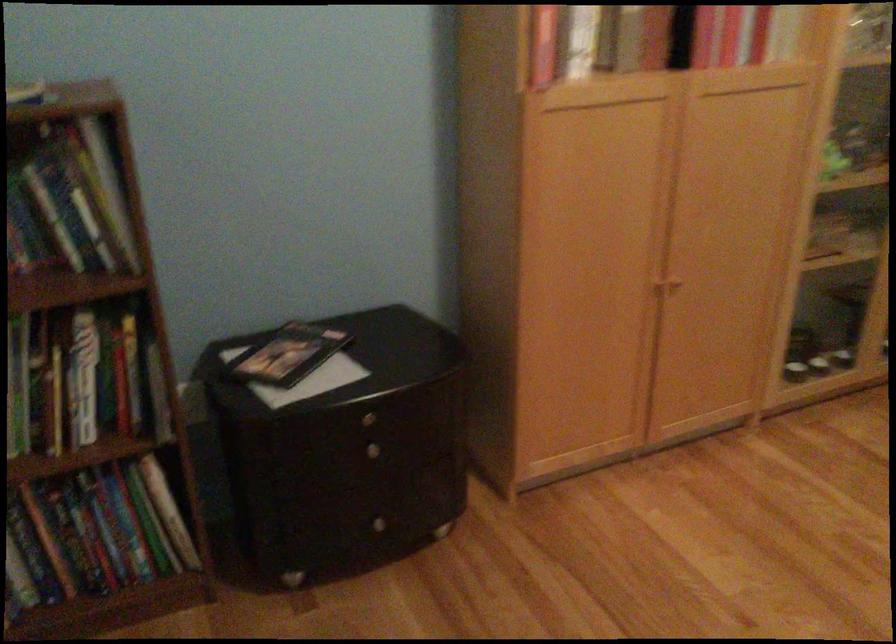
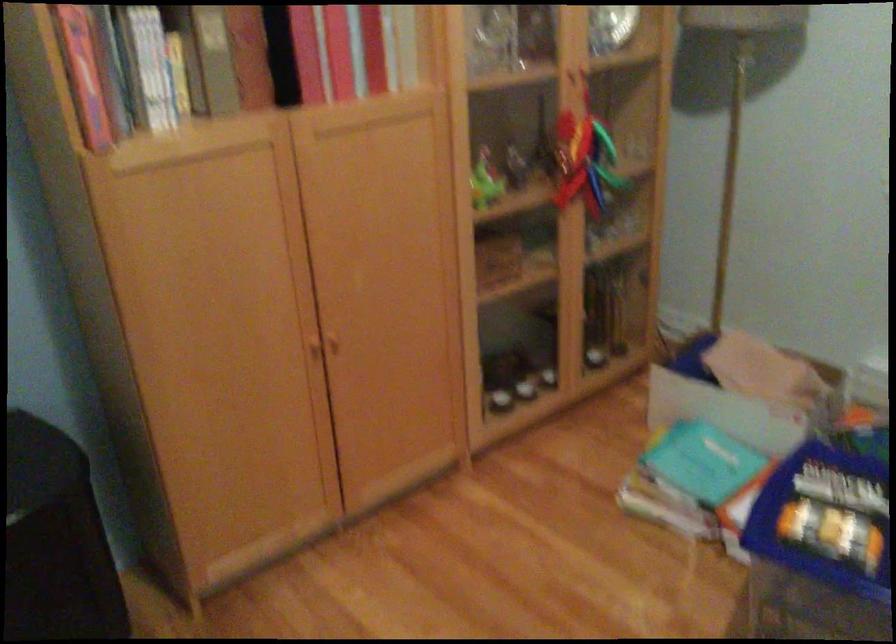
Question: The camera is either moving clockwise (left) or counter-clockwise (right) around the object. The first image is from the beginning of the video and the second image is from the end. Is the camera moving left or right when shooting the video?

Choices:
 (A) Left
 (B) Right

Answer: (A)